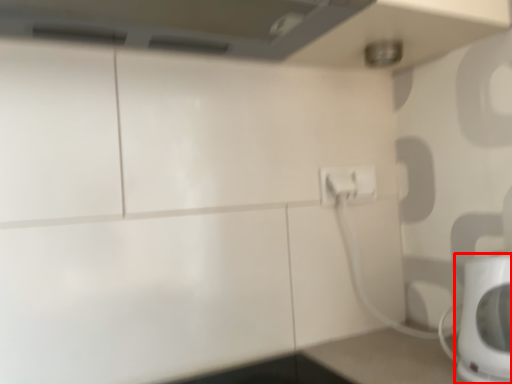
Question: Observing the image, what is the correct spatial positioning of home appliance (annotated by the red box) in reference to electric outlet?

Choices:
 (A) left
 (B) right

Answer: (B)